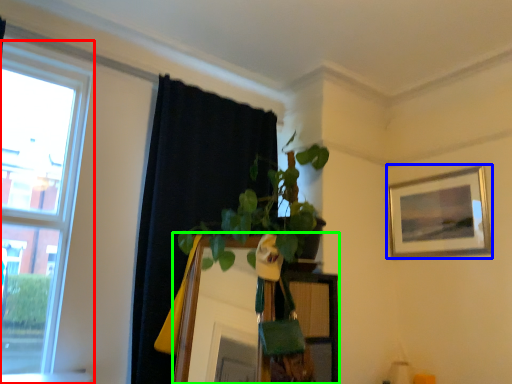
Question: Considering the real-world distances, which object is closest to window (highlighted by a red box)? picture frame (highlighted by a blue box) or mirror (highlighted by a green box).

Choices:
 (A) picture frame
 (B) mirror

Answer: (B)